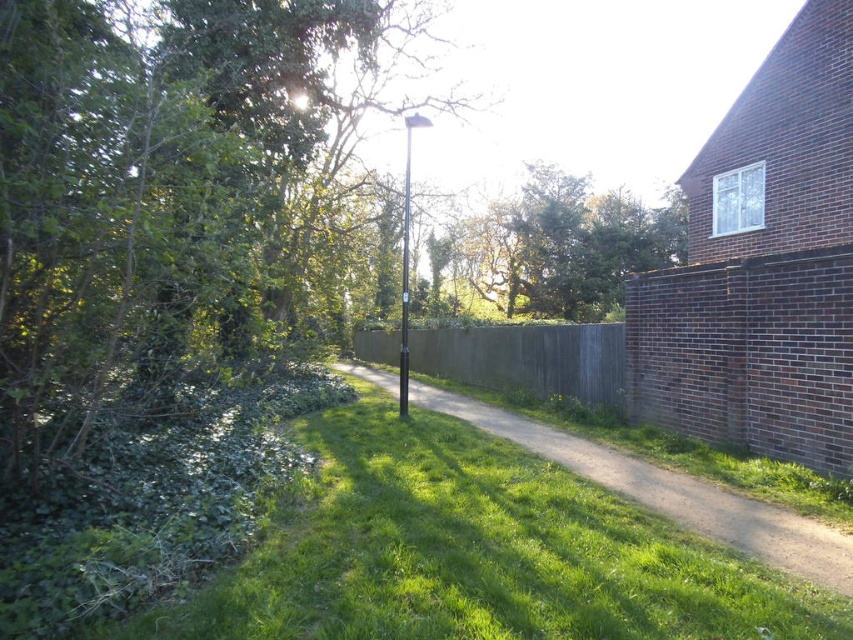
Is dirt path at center below wooden fence at center?

Correct, dirt path at center is located below wooden fence at center.

Does dirt path at center have a lesser height compared to wooden fence at center?

Yes, dirt path at center is shorter than wooden fence at center.

In order to click on dirt path at center in this screenshot , I will do `click(670, 493)`.

Which is below, green leafy tree at center or wooden fence at center?

wooden fence at center

Who is more forward, (589,276) or (505,332)?

Point (505,332) is more forward.

The height and width of the screenshot is (640, 853). What are the coordinates of `green leafy tree at center` in the screenshot? It's located at (566, 244).

Which of these two, green leafy tree at upper left or dirt path at center, stands shorter?

Standing shorter between the two is dirt path at center.

Who is more forward, (61, 212) or (722, 493)?

Point (61, 212)

Measure the distance between point (x=80, y=209) and camera.

4.38 meters

This screenshot has height=640, width=853. I want to click on green leafy tree at upper left, so click(x=163, y=193).